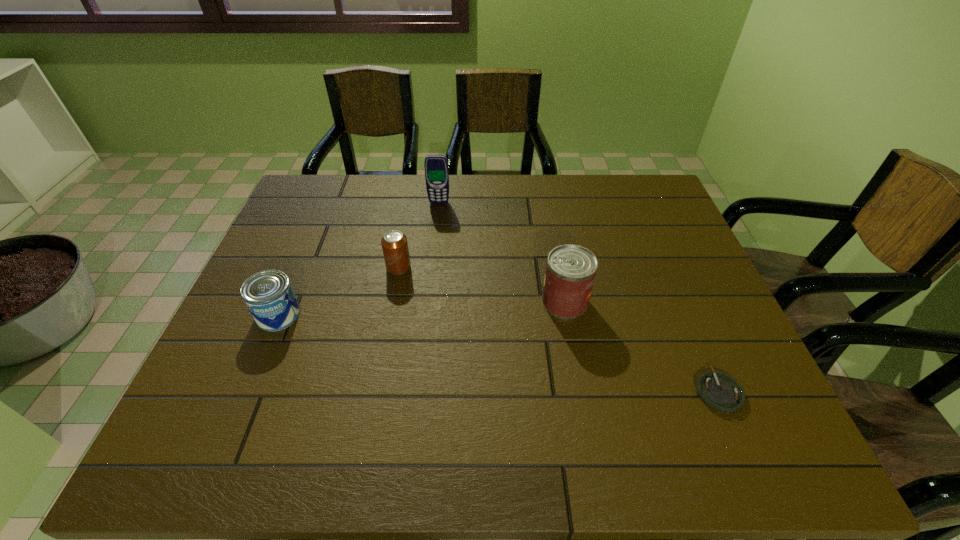
Choose which object is the third nearest neighbor to the second object from left to right. Please provide its 2D coordinates. Your answer should be formatted as a tuple, i.e. [(x, y)], where the tuple contains the x and y coordinates of a point satisfying the conditions above.

[(570, 272)]

Select which can appears as the third closest to the third object from right to left. Please provide its 2D coordinates. Your answer should be formatted as a tuple, i.e. [(x, y)], where the tuple contains the x and y coordinates of a point satisfying the conditions above.

[(268, 295)]

Identify which can is the second closest to the second object from left to right. Please provide its 2D coordinates. Your answer should be formatted as a tuple, i.e. [(x, y)], where the tuple contains the x and y coordinates of a point satisfying the conditions above.

[(570, 272)]

Locate an element on the screen. The height and width of the screenshot is (540, 960). vacant area in the image that satisfies the following two spatial constraints: 1. on the front label of the shortest object; 2. on the right side of the leftmost object is located at coordinates (246, 392).

Find the location of a particular element. This screenshot has width=960, height=540. vacant space that satisfies the following two spatial constraints: 1. on the front-facing side of the farthest object; 2. on the left side of the fourth shortest object is located at coordinates (428, 302).

The height and width of the screenshot is (540, 960). I want to click on free location that satisfies the following two spatial constraints: 1. on the front label of the leftmost can; 2. on the left side of the rightmost object, so click(246, 392).